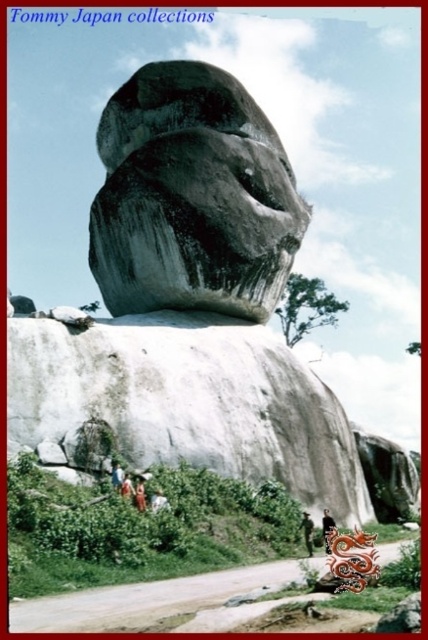
Measure the distance between gray stone sculpture at upper center and gray/weathered rock face at center.

gray stone sculpture at upper center is 11.01 feet away from gray/weathered rock face at center.

Is gray stone sculpture at upper center taller than gray/weathered rock face at center?

Indeed, gray stone sculpture at upper center has a greater height compared to gray/weathered rock face at center.

This screenshot has width=428, height=640. I want to click on gray stone sculpture at upper center, so click(190, 301).

Is gray/weathered rock face at center taller than green fabric shirt at center?

Yes, gray/weathered rock face at center is taller than green fabric shirt at center.

Does gray/weathered rock face at center have a lesser width compared to green fabric shirt at center?

No, gray/weathered rock face at center is not thinner than green fabric shirt at center.

Is point (238, 307) positioned behind point (308, 544)?

Yes, point (238, 307) is farther from viewer.

Where is `gray/weathered rock face at center`? The height and width of the screenshot is (640, 428). gray/weathered rock face at center is located at coordinates (192, 196).

In the scene shown: Does green fabric shirt at center appear over black silk dress at lower center?

Indeed, green fabric shirt at center is positioned over black silk dress at lower center.

Can you confirm if green fabric shirt at center is bigger than black silk dress at lower center?

No.

Is point (306, 516) farther from viewer compared to point (333, 520)?

That is False.

At what (x,y) coordinates should I click in order to perform the action: click on green fabric shirt at center. Please return your answer as a coordinate pair (x, y). Looking at the image, I should click on (308, 531).